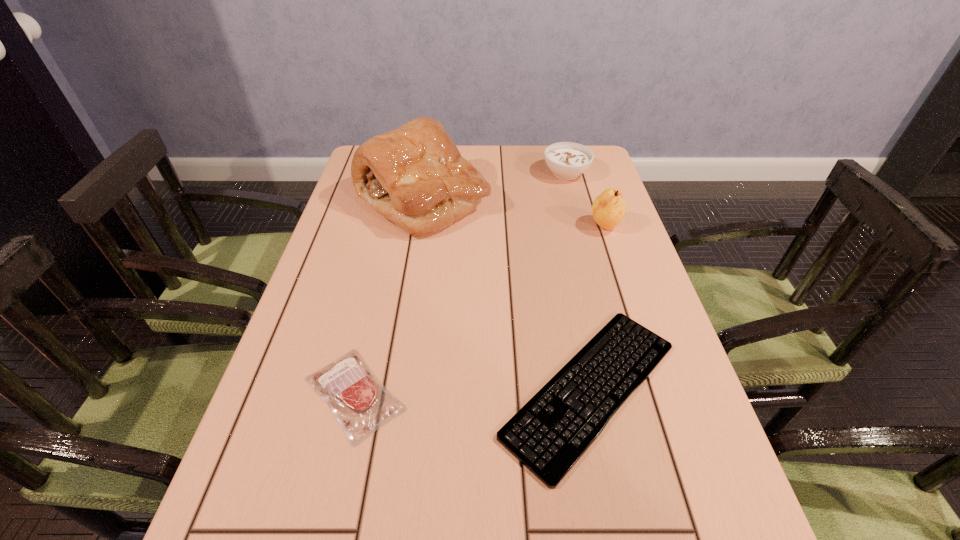
Locate an element on the screen. This screenshot has width=960, height=540. bread at the far edge is located at coordinates (414, 176).

At what (x,y) coordinates should I click in order to perform the action: click on soup bowl present at the far edge. Please return your answer as a coordinate pair (x, y). Looking at the image, I should click on (567, 160).

Locate an element on the screen. This screenshot has width=960, height=540. bread situated at the left edge is located at coordinates point(414,176).

This screenshot has height=540, width=960. I want to click on steak at the left edge, so click(361, 403).

At what (x,y) coordinates should I click in order to perform the action: click on pear present at the right edge. Please return your answer as a coordinate pair (x, y). This screenshot has width=960, height=540. Looking at the image, I should click on (608, 209).

Identify the location of soup bowl that is at the right edge. (567, 160).

In order to click on computer keyboard positioned at the right edge in this screenshot , I will do `click(551, 432)`.

Identify the location of object at the far left corner. (414, 176).

At what (x,y) coordinates should I click in order to perform the action: click on object at the far right corner. Please return your answer as a coordinate pair (x, y). Image resolution: width=960 pixels, height=540 pixels. Looking at the image, I should click on (567, 160).

Locate an element on the screen. This screenshot has width=960, height=540. vacant space at the far edge of the desktop is located at coordinates (490, 144).